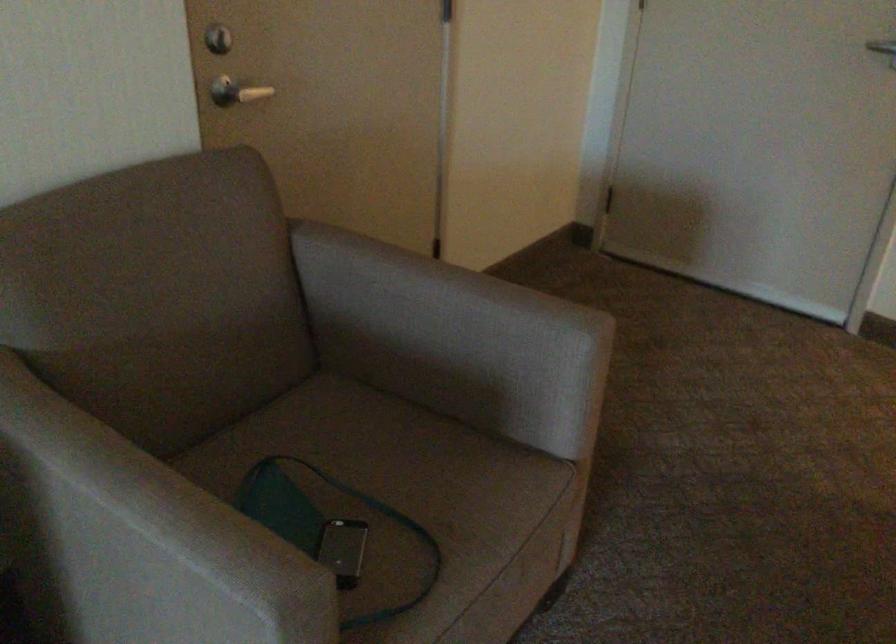
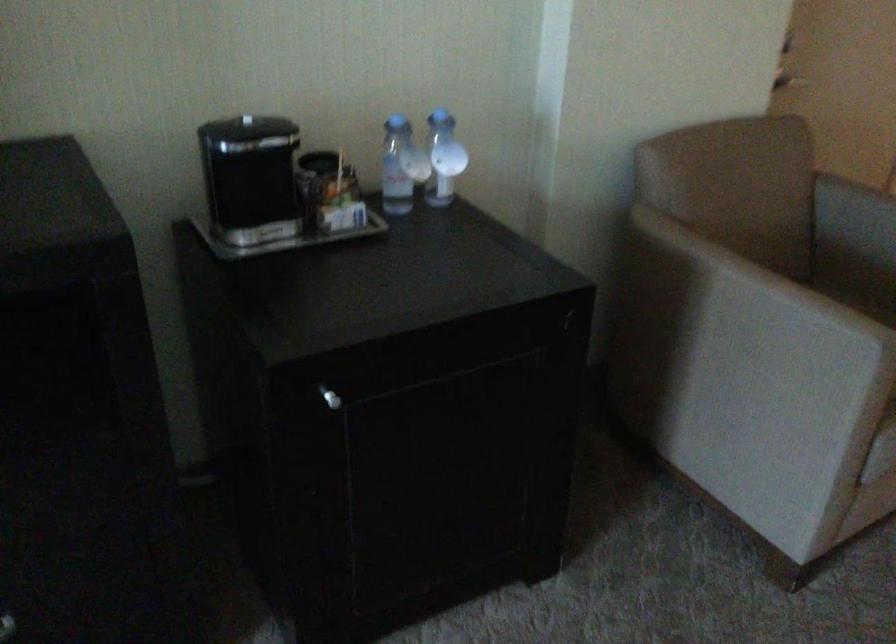
Where in the second image is the point corresponding to (355,422) from the first image?

(859, 303)